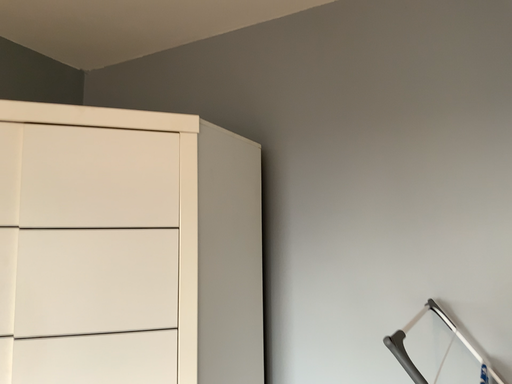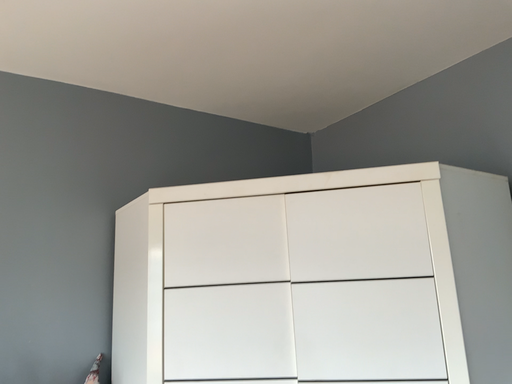
Question: How did the camera likely rotate when shooting the video?

Choices:
 (A) rotated right
 (B) rotated left

Answer: (B)